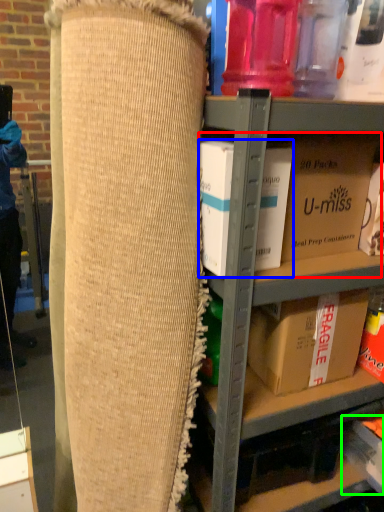
Question: Which object is the farthest from storage box (highlighted by a red box)? Choose among these: box (highlighted by a blue box) or storage box (highlighted by a green box).

Choices:
 (A) box
 (B) storage box

Answer: (B)